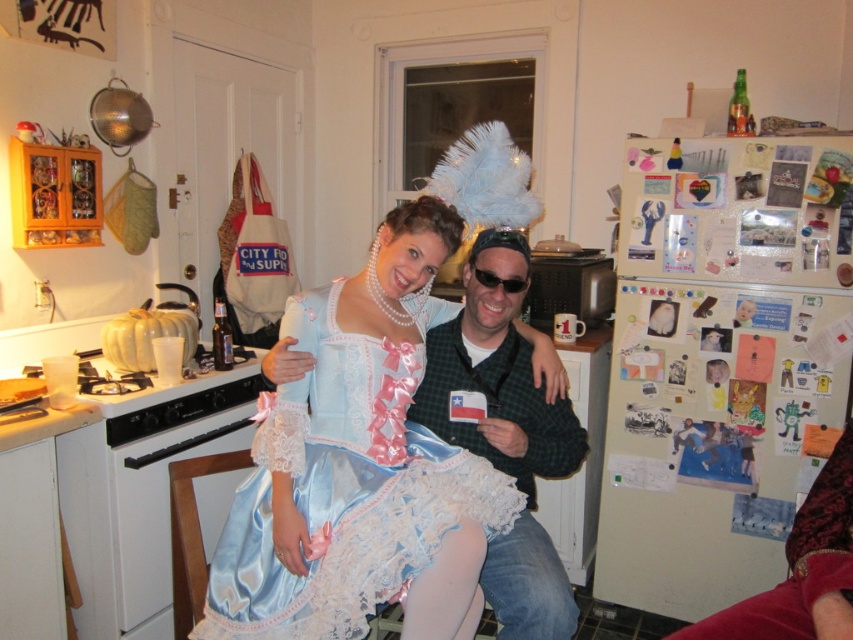
You are organizing a costume party and need to pack these items. Which item, the satin blue dress at center or the black plastic sunglasses at center, requires more space in your luggage?

The satin blue dress at center requires more space in your luggage because it is larger in size than the black plastic sunglasses at center.

You are taking a photo in the kitchen and want to focus on both the point at (260, 449) and the point at (503, 385). Which point should you adjust your focus to first to ensure both are in clear view?

You should focus on point (260, 449) first because it is closer to the camera, allowing the second point to come into focus as you adjust depth of field.